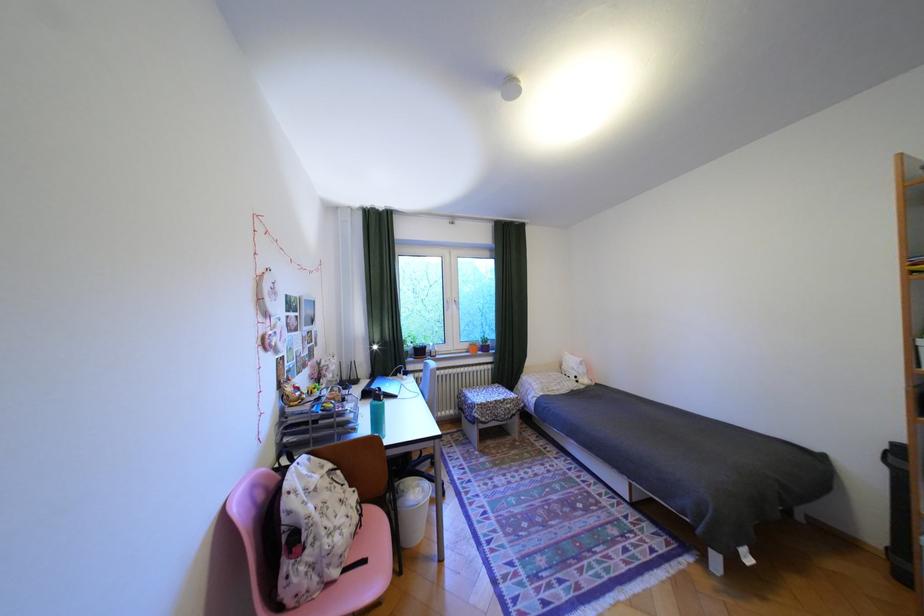
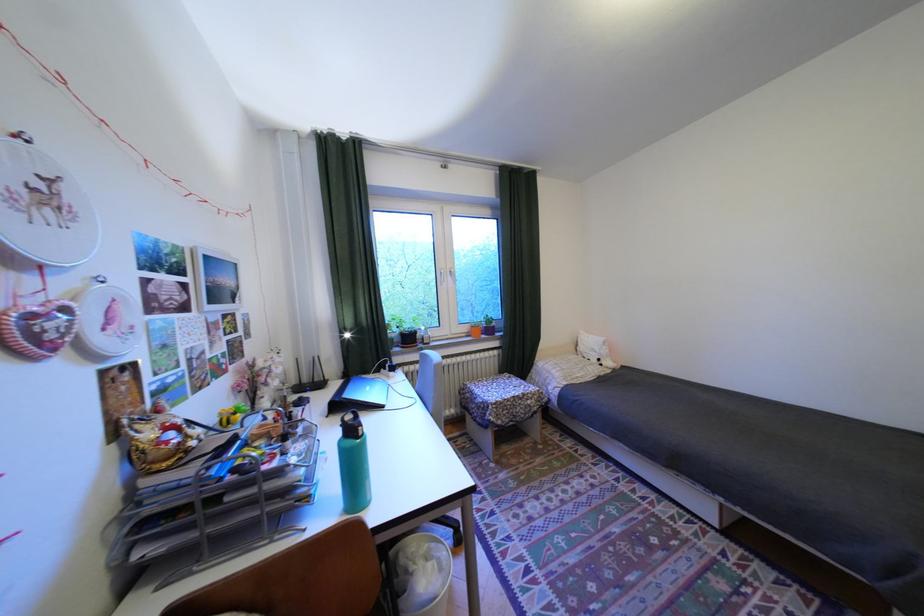
In the second image, find the point that corresponds to (495,419) in the first image.

(512, 422)